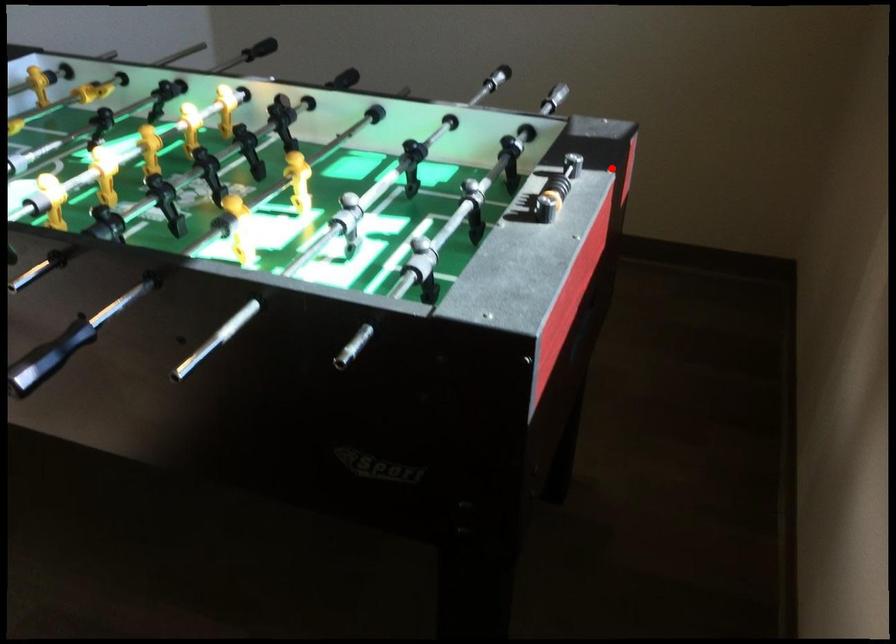
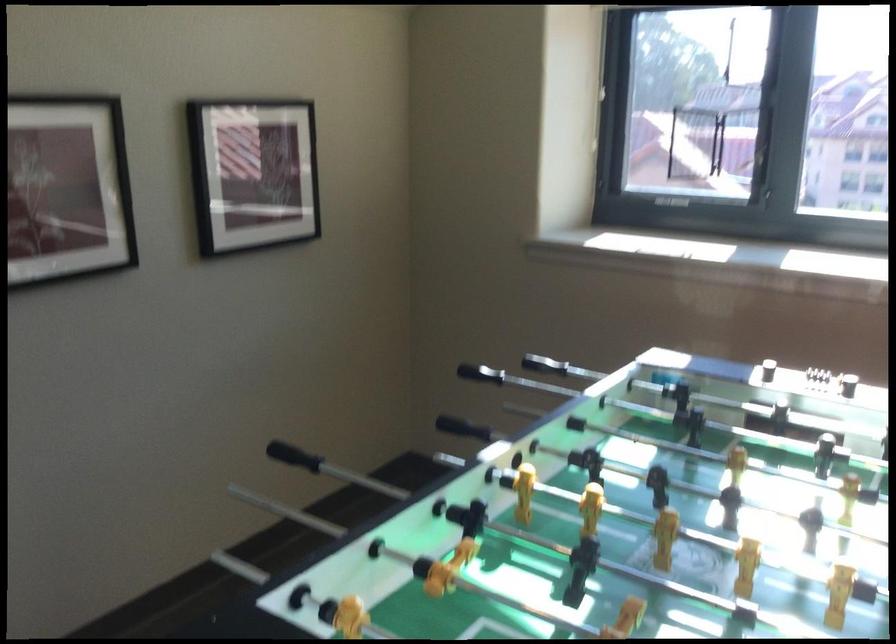
In the second image, find the point that corresponds to the highlighted location in the first image.

(294, 456)